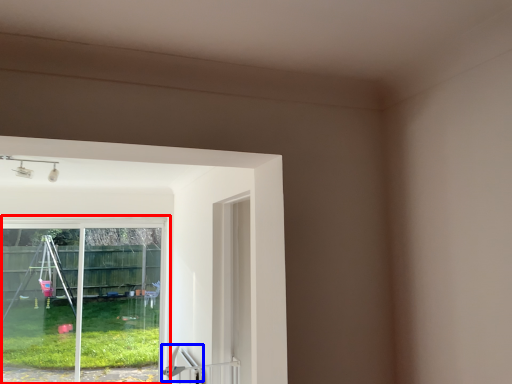
Question: Which point is further to the camera, window (highlighted by a red box) or door handle (highlighted by a blue box)?

Choices:
 (A) window
 (B) door handle

Answer: (A)